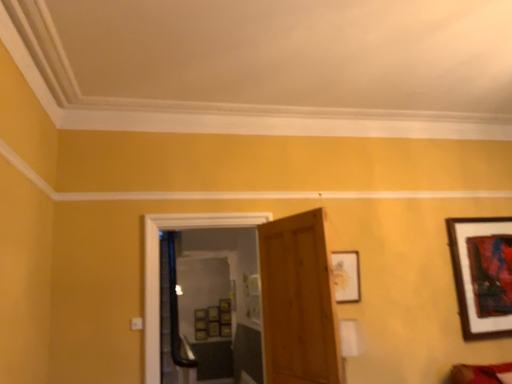
Question: In terms of size, does transparent glass door at center appear bigger or smaller than wooden door at center?

Choices:
 (A) big
 (B) small

Answer: (A)

Question: From a real-world perspective, is transparent glass door at center positioned above or below wooden door at center?

Choices:
 (A) above
 (B) below

Answer: (A)

Question: Estimate the real-world distances between objects in this image. Which object is farther from the wooden picture frame at center-right, marked as the 2th picture frame in a back-to-front arrangement?

Choices:
 (A) transparent glass door at center
 (B) wooden door at center
 (C) wooden framed artwork at upper right, positioned as the first picture frame in back-to-front order

Answer: (A)

Question: Which is farther from the wooden framed artwork at upper right, the 1th picture frame viewed from the right?

Choices:
 (A) transparent glass door at center
 (B) wooden door at center
 (C) wooden picture frame at center-right, the second picture frame positioned from the right

Answer: (A)